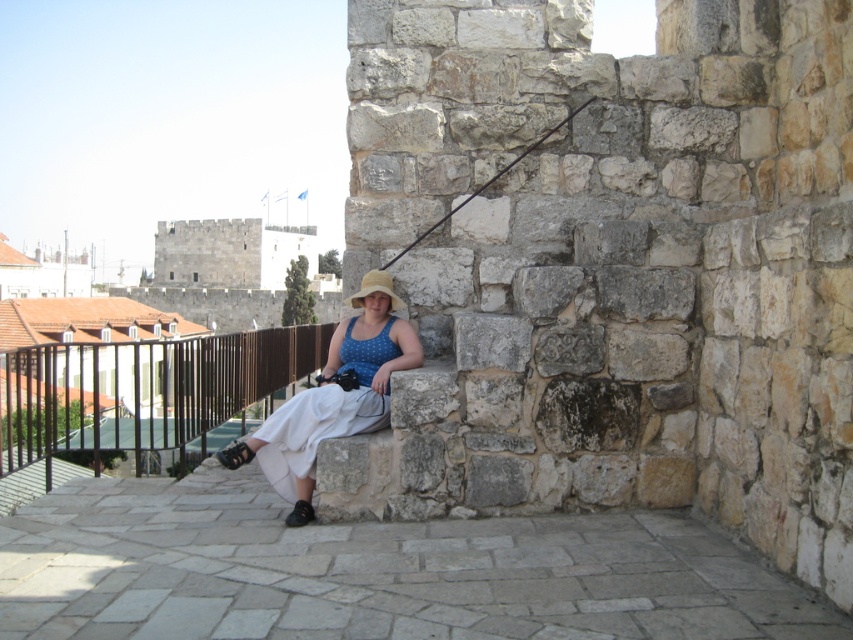
You are a photographer trying to capture a portrait of the person wearing the matte blue dress at center. There is a rusty metal fishing pole at upper center that might obstruct the shot. Based on their relative heights, will the fishing pole block the person from view?

The matte blue dress at center is taller than the rusty metal fishing pole at upper center, so the fishing pole will not block the person from view.

Consider the image. You are a photographer planning to take a picture of the rusty metal fishing pole at upper center. To ensure it is centered in your frame, where should you position your camera? Please provide coordinates based on the image grid system where the bottom left corner is the origin point.

The rusty metal fishing pole at upper center is located at coordinates point (489, 180), so you should position your camera to center the frame at those coordinates to capture it precisely.

You are a photographer trying to capture a shot of the matte blue dress at center and the rusty metal fishing pole at upper center. Based on their positions, which object is closer to the camera?

The matte blue dress at center is positioned under the rusty metal fishing pole at upper center, meaning the rusty metal fishing pole at upper center is closer to the camera.